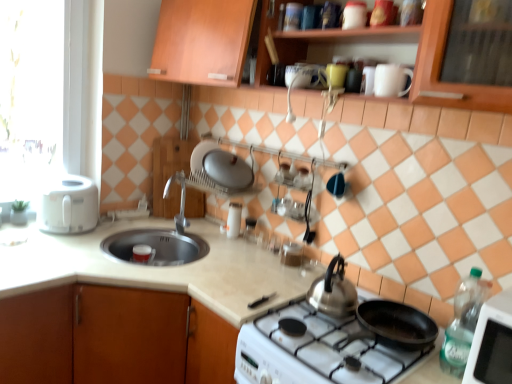
The width and height of the screenshot is (512, 384). I want to click on vacant region above beige laminate countertop at center, placed as the 1th countertop when sorted from left to right (from a real-world perspective), so click(136, 267).